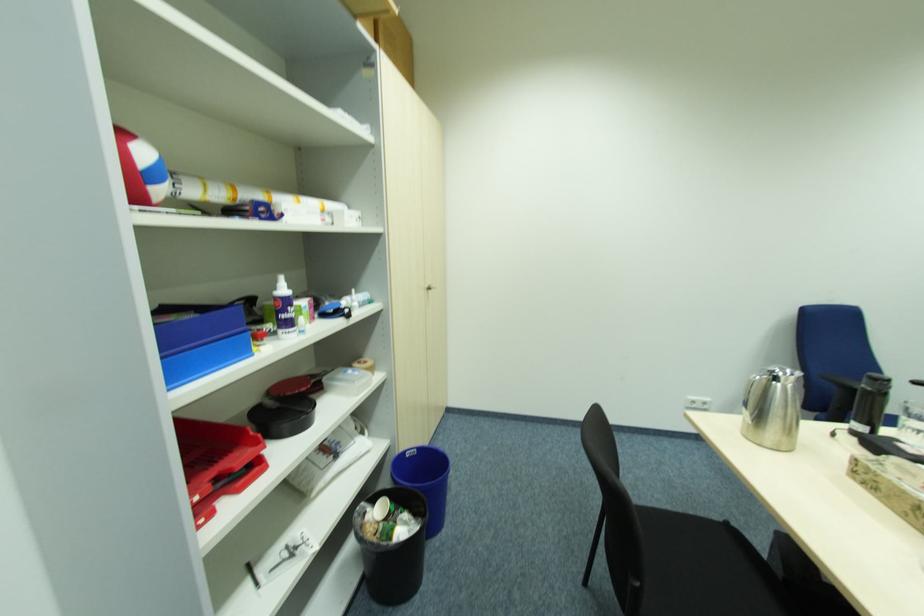
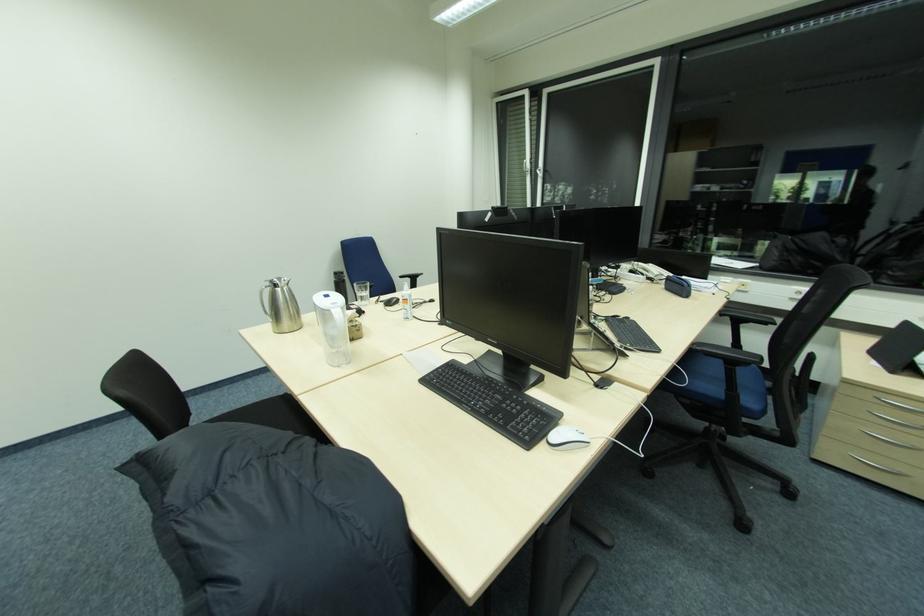
Question: The camera is either moving clockwise (left) or counter-clockwise (right) around the object. The first image is from the beginning of the video and the second image is from the end. Is the camera moving left or right when shooting the video?

Choices:
 (A) Left
 (B) Right

Answer: (A)